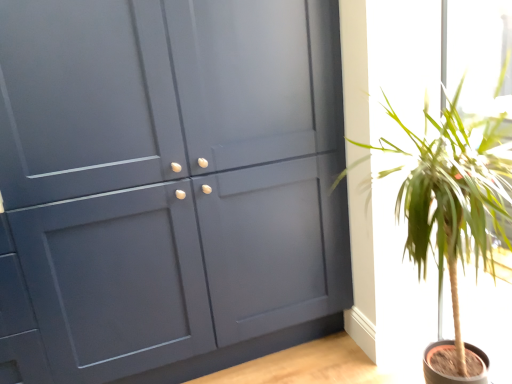
Question: From a real-world perspective, is matte gray cabinet at center positioned above or below green leafy plant at right?

Choices:
 (A) below
 (B) above

Answer: (B)

Question: Does point (79, 135) appear closer or farther from the camera than point (430, 172)?

Choices:
 (A) closer
 (B) farther

Answer: (B)

Question: Do you think matte gray cabinet at center is within green leafy plant at right, or outside of it?

Choices:
 (A) outside
 (B) inside

Answer: (A)

Question: From the image's perspective, is green leafy plant at right above or below matte gray cabinet at center?

Choices:
 (A) above
 (B) below

Answer: (B)

Question: Looking at the image, does green leafy plant at right seem bigger or smaller compared to matte gray cabinet at center?

Choices:
 (A) small
 (B) big

Answer: (A)

Question: Visually, is green leafy plant at right positioned to the left or to the right of matte gray cabinet at center?

Choices:
 (A) right
 (B) left

Answer: (A)

Question: Is green leafy plant at right spatially inside matte gray cabinet at center, or outside of it?

Choices:
 (A) inside
 (B) outside

Answer: (B)